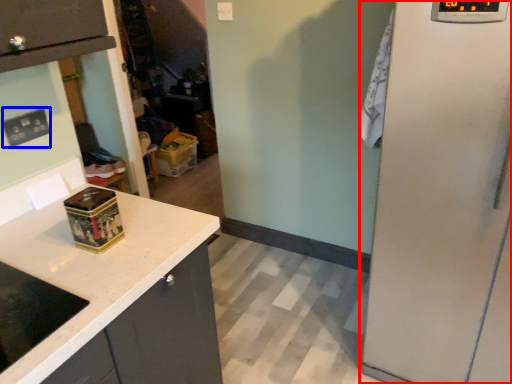
Question: Which point is further to the camera, appliance (highlighted by a red box) or electric outlet (highlighted by a blue box)?

Choices:
 (A) appliance
 (B) electric outlet

Answer: (B)